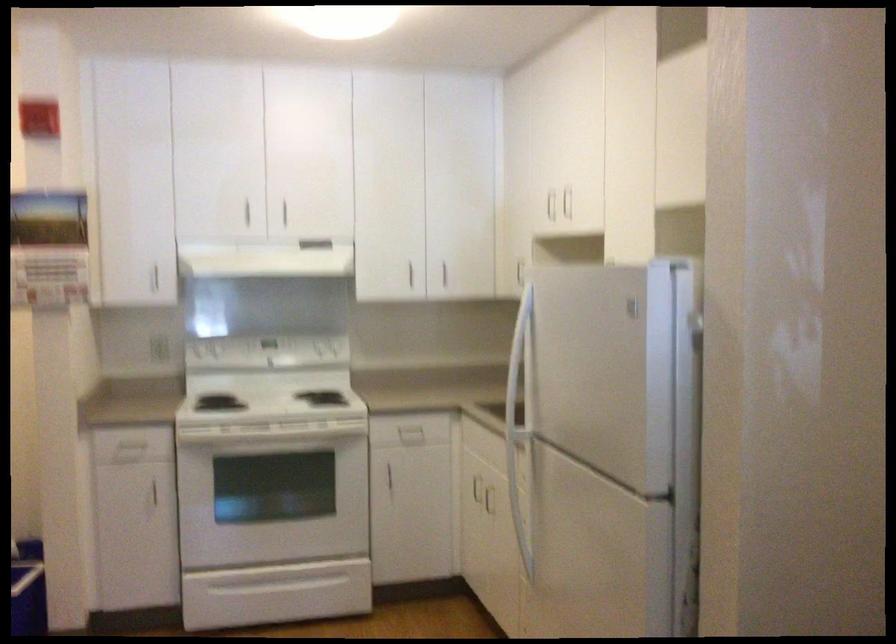
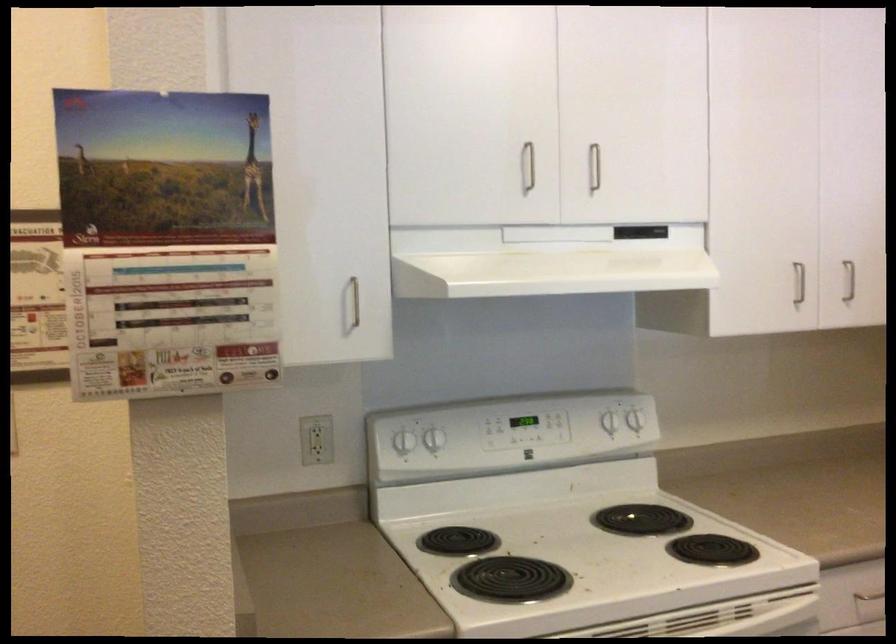
Find the pixel in the second image that matches pixel 248 209 in the first image.

(528, 166)